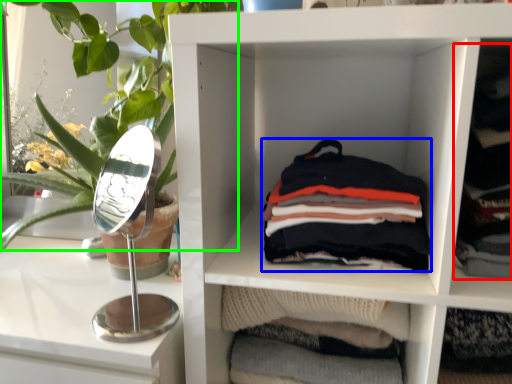
Question: Estimate the real-world distances between objects in this image. Which object is closer to clothing (highlighted by a red box), material (highlighted by a blue box) or plant (highlighted by a green box)?

Choices:
 (A) material
 (B) plant

Answer: (A)